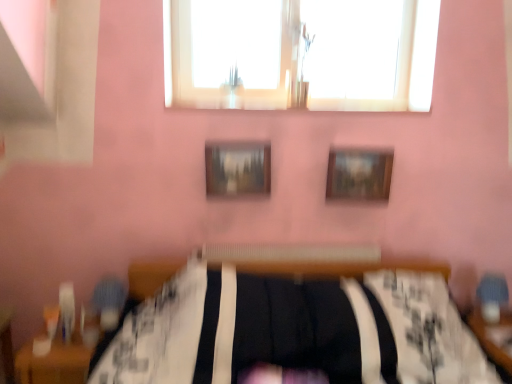
Question: Is wooden table at lower right, the 2th table from the left, touching wooden picture frame at upper center, which appears as the first picture frame when viewed from the right?

Choices:
 (A) no
 (B) yes

Answer: (A)

Question: Can you confirm if wooden table at lower right, placed as the 1th table when sorted from right to left, is taller than wooden picture frame at upper center, the second picture frame when ordered from left to right?

Choices:
 (A) no
 (B) yes

Answer: (B)

Question: Does wooden table at lower right, the 2th table from the left, turn towards wooden picture frame at upper center, the second picture frame when ordered from left to right?

Choices:
 (A) yes
 (B) no

Answer: (B)

Question: Is wooden table at lower right, placed as the 1th table when sorted from right to left, turned away from wooden picture frame at upper center, which appears as the first picture frame when viewed from the right?

Choices:
 (A) no
 (B) yes

Answer: (A)

Question: Would you say wooden picture frame at upper center, which appears as the first picture frame when viewed from the right, is part of wooden table at lower right, the 2th table from the left,'s contents?

Choices:
 (A) no
 (B) yes

Answer: (A)

Question: Is wooden table at lower right, placed as the 1th table when sorted from right to left, to the left of wooden picture frame at upper center, the second picture frame when ordered from left to right, from the viewer's perspective?

Choices:
 (A) no
 (B) yes

Answer: (A)

Question: Is the surface of wooden table at lower right, the 2th table from the left, in direct contact with wooden textured picture frame at center, positioned as the first picture frame in left-to-right order?

Choices:
 (A) yes
 (B) no

Answer: (B)

Question: Does wooden table at lower right, placed as the 1th table when sorted from right to left, lie in front of wooden textured picture frame at center, positioned as the first picture frame in left-to-right order?

Choices:
 (A) no
 (B) yes

Answer: (B)

Question: From the image's perspective, is wooden table at lower right, placed as the 1th table when sorted from right to left, on wooden textured picture frame at center, positioned as the first picture frame in left-to-right order?

Choices:
 (A) no
 (B) yes

Answer: (A)

Question: Is wooden table at lower right, the 2th table from the left, surrounding wooden textured picture frame at center, acting as the second picture frame starting from the right?

Choices:
 (A) no
 (B) yes

Answer: (A)

Question: Does wooden table at lower right, placed as the 1th table when sorted from right to left, have a lesser height compared to wooden textured picture frame at center, positioned as the first picture frame in left-to-right order?

Choices:
 (A) yes
 (B) no

Answer: (B)

Question: From a real-world perspective, is wooden table at lower right, placed as the 1th table when sorted from right to left, positioned under wooden textured picture frame at center, acting as the second picture frame starting from the right, based on gravity?

Choices:
 (A) yes
 (B) no

Answer: (A)

Question: Is transparent glass window at upper center to the right of wooden textured picture frame at center, acting as the second picture frame starting from the right, from the viewer's perspective?

Choices:
 (A) no
 (B) yes

Answer: (B)